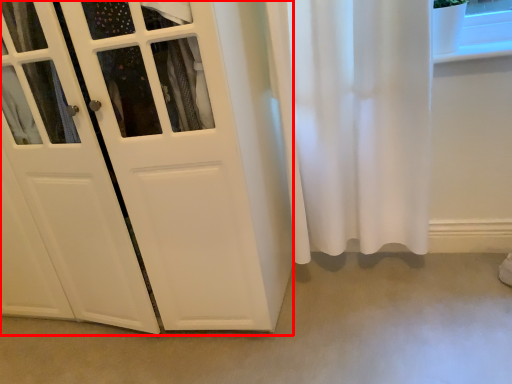
Question: From the image's perspective, what is the correct spatial positioning of door (annotated by the red box) in reference to concrete?

Choices:
 (A) above
 (B) below

Answer: (A)